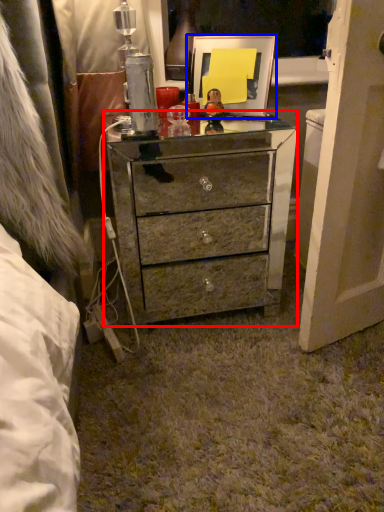
Question: Among these objects, which one is nearest to the camera, chest of drawers (highlighted by a red box) or picture frame (highlighted by a blue box)?

Choices:
 (A) chest of drawers
 (B) picture frame

Answer: (A)